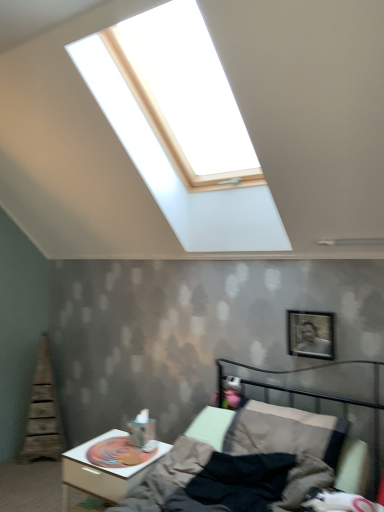
Measure the distance between white glossy nightstand at lower left and camera.

A distance of 2.02 meters exists between white glossy nightstand at lower left and camera.

Where is `metallic silver picture frame at upper right`? metallic silver picture frame at upper right is located at coordinates (310, 334).

Which object is positioned more to the right, metallic gray bed at lower right or white glossy nightstand at lower left?

Positioned to the right is metallic gray bed at lower right.

In the image, is metallic gray bed at lower right positioned in front of or behind white glossy nightstand at lower left?

metallic gray bed at lower right is in front of white glossy nightstand at lower left.

Measure the distance from metallic gray bed at lower right to white glossy nightstand at lower left.

metallic gray bed at lower right and white glossy nightstand at lower left are 32.53 inches apart from each other.

Who is smaller, metallic gray bed at lower right or white glossy nightstand at lower left?

With smaller size is white glossy nightstand at lower left.

Would you say metallic gray bed at lower right is a long distance from metallic silver picture frame at upper right?

metallic gray bed at lower right is near metallic silver picture frame at upper right, not far away.

Which is in front, point (322, 366) or point (326, 324)?

Positioned in front is point (326, 324).

Considering the relative sizes of metallic gray bed at lower right and metallic silver picture frame at upper right in the image provided, is metallic gray bed at lower right taller than metallic silver picture frame at upper right?

Yes, metallic gray bed at lower right is taller than metallic silver picture frame at upper right.

From a real-world perspective, is metallic gray bed at lower right over metallic silver picture frame at upper right?

Actually, metallic gray bed at lower right is physically below metallic silver picture frame at upper right in the real world.

Is white glossy nightstand at lower left at the right side of metallic gray bed at lower right?

No.

Does white glossy nightstand at lower left have a larger size compared to metallic gray bed at lower right?

No.

I want to click on nightstand below the metallic gray bed at lower right (from a real-world perspective), so click(104, 469).

From a real-world perspective, does white glossy nightstand at lower left stand above metallic gray bed at lower right?

No, from a real-world perspective, white glossy nightstand at lower left is not above metallic gray bed at lower right.

Does metallic silver picture frame at upper right have a greater height compared to white glossy nightstand at lower left?

No.

From the image's perspective, who appears lower, metallic silver picture frame at upper right or white glossy nightstand at lower left?

white glossy nightstand at lower left appears lower in the image.

Would you say metallic silver picture frame at upper right is inside or outside white glossy nightstand at lower left?

metallic silver picture frame at upper right is spatially situated outside white glossy nightstand at lower left.

Which is in front, metallic silver picture frame at upper right or metallic gray bed at lower right?

metallic gray bed at lower right is closer to the camera.

Are metallic silver picture frame at upper right and metallic gray bed at lower right making contact?

No, metallic silver picture frame at upper right is not in contact with metallic gray bed at lower right.

How different are the orientations of metallic silver picture frame at upper right and metallic gray bed at lower right in degrees?

The facing directions of metallic silver picture frame at upper right and metallic gray bed at lower right are 0.142 degrees apart.

Is metallic silver picture frame at upper right oriented towards metallic gray bed at lower right?

No, metallic silver picture frame at upper right is not oriented towards metallic gray bed at lower right.

Measure the distance between white glossy nightstand at lower left and metallic silver picture frame at upper right.

The distance of white glossy nightstand at lower left from metallic silver picture frame at upper right is 1.11 meters.

Is white glossy nightstand at lower left thinner than metallic silver picture frame at upper right?

No, white glossy nightstand at lower left is not thinner than metallic silver picture frame at upper right.

Considering the points (70, 464) and (323, 339), which point is in front, point (70, 464) or point (323, 339)?

The point (70, 464) is closer to the camera.

Is white glossy nightstand at lower left positioned with its back to metallic silver picture frame at upper right?

No, white glossy nightstand at lower left's orientation is not away from metallic silver picture frame at upper right.

At what (x,y) coordinates should I click in order to perform the action: click on bed above the white glossy nightstand at lower left (from a real-world perspective). Please return your answer as a coordinate pair (x, y). The height and width of the screenshot is (512, 384). Looking at the image, I should click on (317, 395).

Where is `picture frame that appears above the metallic gray bed at lower right (from the image's perspective)`? The height and width of the screenshot is (512, 384). picture frame that appears above the metallic gray bed at lower right (from the image's perspective) is located at coordinates (310, 334).

Considering their positions, is metallic gray bed at lower right positioned further to white glossy nightstand at lower left than metallic silver picture frame at upper right?

Based on the image, metallic silver picture frame at upper right appears to be further to white glossy nightstand at lower left.

Based on their spatial positions, is white glossy nightstand at lower left or metallic silver picture frame at upper right closer to metallic gray bed at lower right?

metallic silver picture frame at upper right is positioned closer to the anchor metallic gray bed at lower right.

Which object lies nearer to the anchor point metallic silver picture frame at upper right, white glossy nightstand at lower left or metallic gray bed at lower right?

metallic gray bed at lower right is closer to metallic silver picture frame at upper right.

Considering their positions, is metallic gray bed at lower right positioned further to metallic silver picture frame at upper right than white glossy nightstand at lower left?

Among the two, white glossy nightstand at lower left is located further to metallic silver picture frame at upper right.

Consider the image. From the image, which object appears to be nearer to white glossy nightstand at lower left, metallic silver picture frame at upper right or metallic gray bed at lower right?

metallic gray bed at lower right lies closer to white glossy nightstand at lower left than the other object.

Based on their spatial positions, is metallic silver picture frame at upper right or white glossy nightstand at lower left further from metallic gray bed at lower right?

white glossy nightstand at lower left is further to metallic gray bed at lower right.

Locate an element on the screen. The height and width of the screenshot is (512, 384). bed situated between white glossy nightstand at lower left and metallic silver picture frame at upper right from left to right is located at coordinates (317, 395).